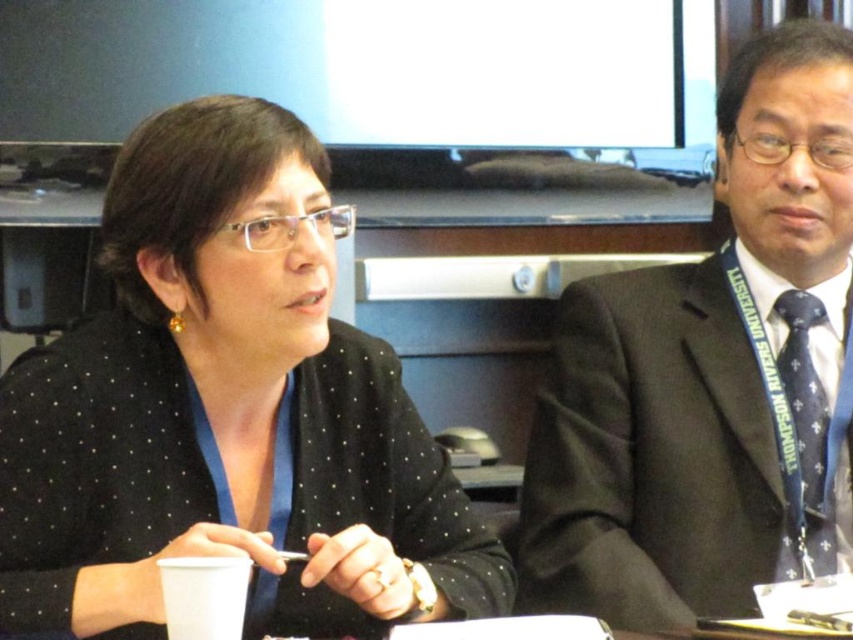
Question: Can you confirm if black dotted blazer at upper left is smaller than dark blue textured tie at right?

Choices:
 (A) no
 (B) yes

Answer: (A)

Question: Does black suit at center appear on the left side of dark blue textured tie at right?

Choices:
 (A) no
 (B) yes

Answer: (B)

Question: Is black dotted blazer at upper left to the left of black suit at center from the viewer's perspective?

Choices:
 (A) no
 (B) yes

Answer: (B)

Question: Which object is closer to the camera taking this photo?

Choices:
 (A) black suit at center
 (B) black dotted blazer at upper left

Answer: (B)

Question: Which of these objects is positioned closest to the dark blue textured tie at right?

Choices:
 (A) black suit at center
 (B) black dotted blazer at upper left

Answer: (A)

Question: Which of these objects is positioned closest to the black suit at center?

Choices:
 (A) dark blue textured tie at right
 (B) black dotted blazer at upper left

Answer: (A)